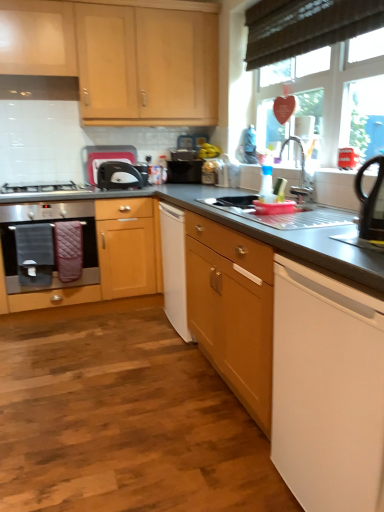
Question: In which direction should I rotate to look at white plastic toaster at upper center, which is the second appliance in front-to-back order?

Choices:
 (A) right
 (B) left

Answer: (B)

Question: Is metallic faucet at upper right outside black matte microwave at center?

Choices:
 (A) yes
 (B) no

Answer: (A)

Question: Is metallic faucet at upper right looking in the opposite direction of black matte microwave at center?

Choices:
 (A) no
 (B) yes

Answer: (A)

Question: Does metallic faucet at upper right contain black matte microwave at center?

Choices:
 (A) no
 (B) yes

Answer: (A)

Question: From a real-world perspective, is metallic faucet at upper right on black matte microwave at center?

Choices:
 (A) yes
 (B) no

Answer: (A)

Question: Does metallic faucet at upper right have a larger size compared to black matte microwave at center?

Choices:
 (A) no
 (B) yes

Answer: (A)

Question: Is metallic faucet at upper right shorter than black matte microwave at center?

Choices:
 (A) yes
 (B) no

Answer: (B)

Question: From the image's perspective, is satin silver gas stove at left under stainless steel oven at left, the 1th home appliance when ordered from left to right?

Choices:
 (A) no
 (B) yes

Answer: (A)

Question: Does satin silver gas stove at left appear on the right side of stainless steel oven at left, which appears as the 2th home appliance when viewed from the right?

Choices:
 (A) yes
 (B) no

Answer: (B)

Question: Is stainless steel oven at left, the 1th home appliance when ordered from left to right, surrounded by satin silver gas stove at left?

Choices:
 (A) yes
 (B) no

Answer: (B)

Question: Does satin silver gas stove at left turn towards stainless steel oven at left, placed as the 2th home appliance when sorted from front to back?

Choices:
 (A) yes
 (B) no

Answer: (B)

Question: Considering the relative sizes of satin silver gas stove at left and stainless steel oven at left, which is the 1th home appliance from back to front, in the image provided, is satin silver gas stove at left thinner than stainless steel oven at left, which is the 1th home appliance from back to front,?

Choices:
 (A) yes
 (B) no

Answer: (A)

Question: From a real-world perspective, is satin silver gas stove at left physically above stainless steel oven at left, which appears as the 2th home appliance when viewed from the right?

Choices:
 (A) no
 (B) yes

Answer: (B)

Question: Is black plastic kettle at right, placed as the 1th appliance when sorted from right to left, facing away from satin silver gas stove at left?

Choices:
 (A) yes
 (B) no

Answer: (B)